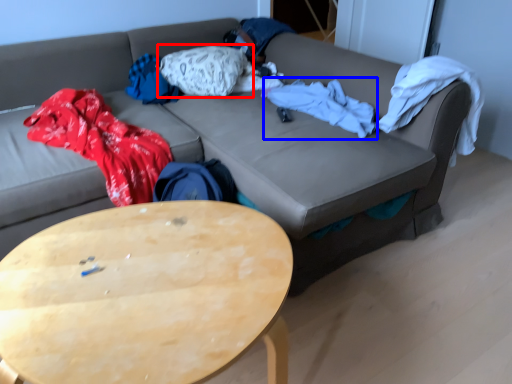
Question: Which of the following is the farthest to the observer, pillow (highlighted by a red box) or blanket (highlighted by a blue box)?

Choices:
 (A) pillow
 (B) blanket

Answer: (A)